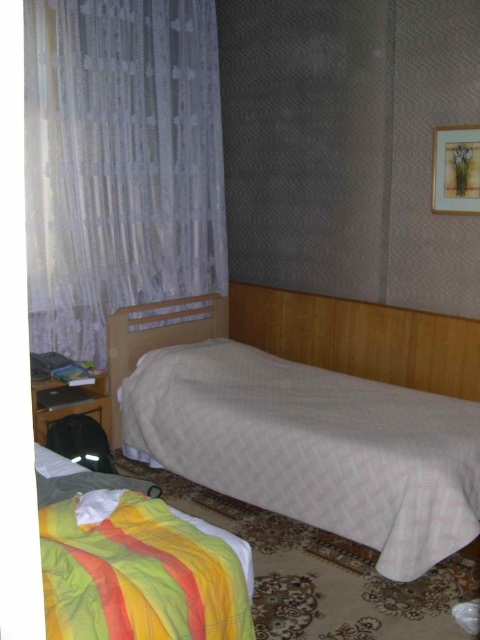
Question: Which of the following is the farthest from the observer?

Choices:
 (A) (66, 614)
 (B) (343, 509)

Answer: (B)

Question: Can you confirm if white woven bed at center is smaller than striped cotton blanket at lower left?

Choices:
 (A) no
 (B) yes

Answer: (A)

Question: Can you confirm if white woven bed at center is positioned to the left of white sheer curtain at left?

Choices:
 (A) no
 (B) yes

Answer: (A)

Question: Which is farther from the white sheer curtain at left?

Choices:
 (A) striped cotton blanket at lower left
 (B) white woven bed at center

Answer: (A)

Question: Which object is the farthest from the striped cotton blanket at lower left?

Choices:
 (A) white sheer curtain at left
 (B) white woven bed at center

Answer: (A)

Question: Is the position of white woven bed at center less distant than that of white sheer curtain at left?

Choices:
 (A) no
 (B) yes

Answer: (B)